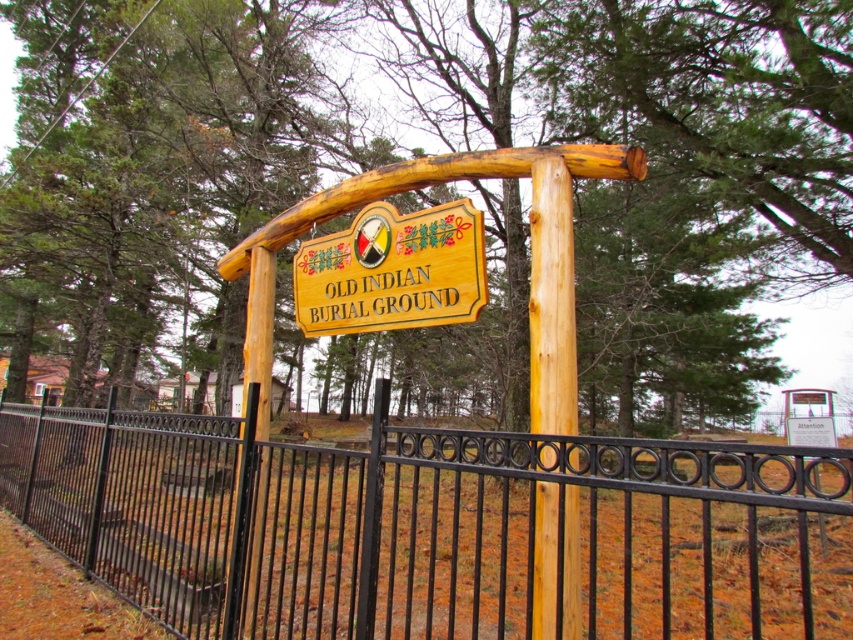
Question: Can you confirm if black wrought iron fence at center is positioned below natural wood post at center?

Choices:
 (A) yes
 (B) no

Answer: (A)

Question: Which point is farther from the camera taking this photo?

Choices:
 (A) (540, 592)
 (B) (798, 509)
 (C) (349, 304)
 (D) (647, 113)

Answer: (D)

Question: From the image, what is the correct spatial relationship of brown wood tree at center in relation to black wrought iron fence at center?

Choices:
 (A) above
 (B) below

Answer: (A)

Question: Is black wrought iron fence at center positioned in front of natural wood post at center?

Choices:
 (A) yes
 (B) no

Answer: (A)

Question: Which of the following is the farthest from the observer?

Choices:
 (A) (465, 314)
 (B) (544, 572)
 (C) (293, 554)
 (D) (664, 301)

Answer: (D)

Question: Which of the following is the closest to the observer?

Choices:
 (A) wooden sign at center
 (B) brown wood tree at center

Answer: (A)